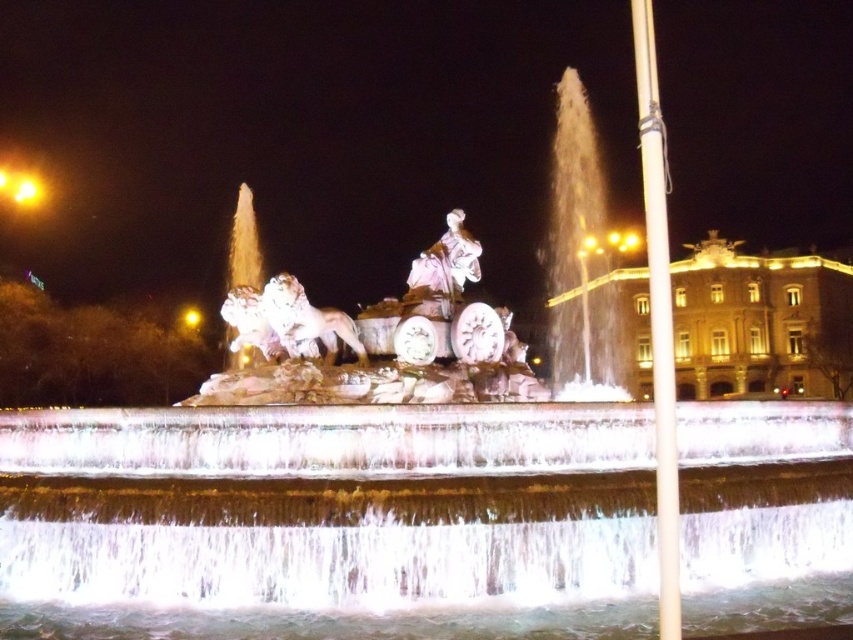
Question: Considering the real-world distances, which object is farthest from the white marble statue at center?

Choices:
 (A) clear water at center
 (B) golden stone palace at center right

Answer: (B)

Question: Is clear water at center to the left of golden stone palace at center right from the viewer's perspective?

Choices:
 (A) yes
 (B) no

Answer: (A)

Question: From the image, what is the correct spatial relationship of clear water at center in relation to golden stone palace at center right?

Choices:
 (A) right
 (B) left

Answer: (B)

Question: Does clear water at center have a smaller size compared to white marble statue at center?

Choices:
 (A) no
 (B) yes

Answer: (A)

Question: Which object is closer to the camera taking this photo?

Choices:
 (A) clear water at center
 (B) golden stone palace at center right
 (C) white marble statue at center

Answer: (A)

Question: Estimate the real-world distances between objects in this image. Which object is closer to the clear water at center?

Choices:
 (A) white marble statue at center
 (B) golden stone palace at center right

Answer: (A)